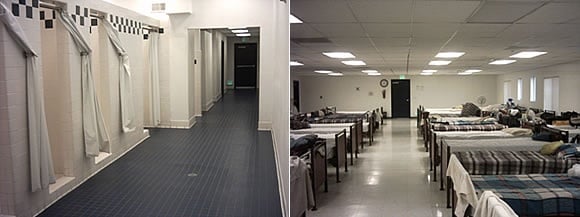
Find the location of a particular element. sheet is located at coordinates pyautogui.click(x=521, y=173).